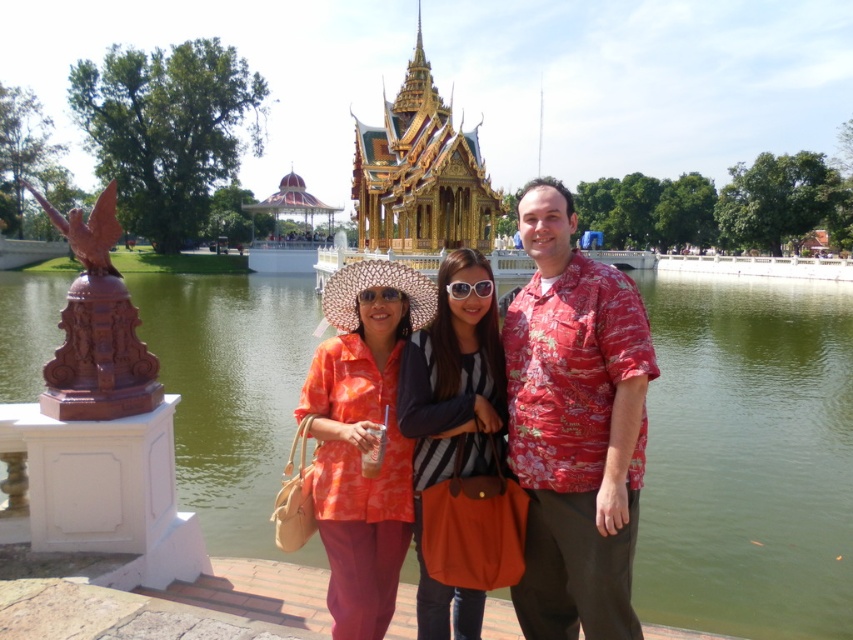
You are a photographer trying to capture a group shot of the matte orange shirt at center and the matte black goggles at center. Since they are both at the center, how can you determine their relative positions to ensure proper framing?

The matte orange shirt at center is positioned on the right side of the matte black goggles at center, so you should frame the matte orange shirt at center to the right of the matte black goggles at center.

You are a photographer trying to capture a group shot of the two people in the center wearing the floral print shirt at center and orange printed shirt at center. Based on their positions, which one is standing to the right of the other?

The floral print shirt at center is positioned on the right side of orange printed shirt at center, so the person wearing the floral print shirt at center is standing to the right of the person in the orange printed shirt at center.